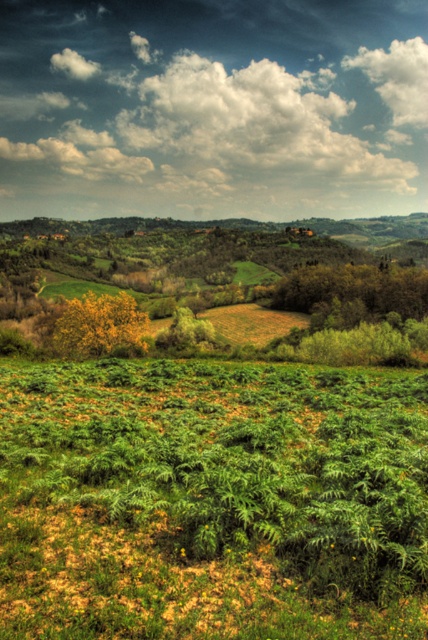
Does white fluffy cloud at upper center appear over white fluffy cloud at upper right?

No.

Can you confirm if white fluffy cloud at upper center is taller than white fluffy cloud at upper right?

Correct, white fluffy cloud at upper center is much taller as white fluffy cloud at upper right.

Is point (180, 124) closer to camera compared to point (385, 93)?

Yes.

Where is `white fluffy cloud at upper center`? The height and width of the screenshot is (640, 428). white fluffy cloud at upper center is located at coordinates (213, 108).